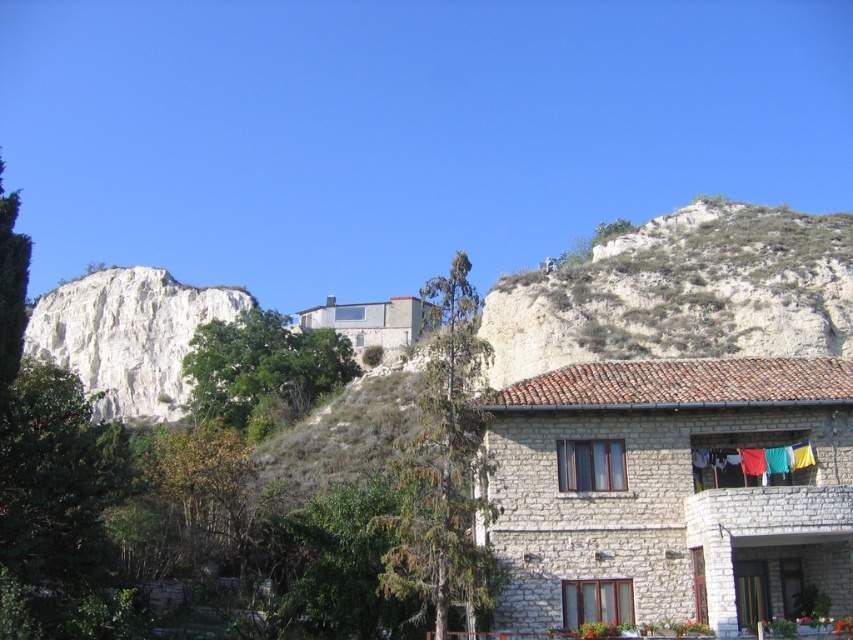
Who is more distant from viewer, (329, 353) or (740, 461)?

Positioned behind is point (329, 353).

Who is more forward, (321, 348) or (715, 451)?

Point (715, 451)

Where is `green leafy tree at upper center`? The width and height of the screenshot is (853, 640). green leafy tree at upper center is located at coordinates (262, 371).

Is green leafy tree at center thinner than green fabric clothes at lower right?

Yes, green leafy tree at center is thinner than green fabric clothes at lower right.

Does green leafy tree at center have a lesser height compared to green fabric clothes at lower right?

No, green leafy tree at center is not shorter than green fabric clothes at lower right.

Between point (405, 472) and point (724, 467), which one is positioned in front?

Point (405, 472) is in front.

Locate an element on the screen. This screenshot has width=853, height=640. green leafy tree at center is located at coordinates (444, 467).

How far apart are green leafy tree at center and green leafy tree at upper center?

A: green leafy tree at center and green leafy tree at upper center are 70.17 meters apart from each other.

Between green leafy tree at center and green leafy tree at upper center, which one appears on the left side from the viewer's perspective?

Positioned to the left is green leafy tree at upper center.

Who is more forward, (438, 500) or (215, 385)?

Point (438, 500)

Identify the location of green leafy tree at center. (444, 467).